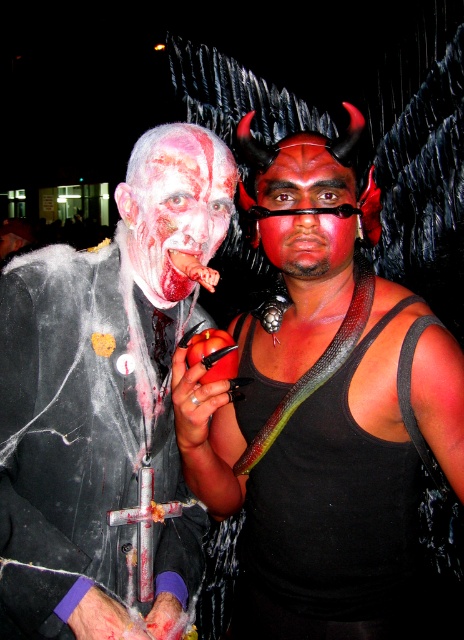
Who is taller, green snake at center or matte red face paint at center?

green snake at center is taller.

Does point (265, 412) come in front of point (323, 268)?

No, (265, 412) is behind (323, 268).

Is point (210, 627) more distant than point (283, 147)?

Yes, point (210, 627) is farther from viewer.

The width and height of the screenshot is (464, 640). Find the location of `green snake at center`. green snake at center is located at coordinates (332, 525).

Between matte black cross at center and green snake at center, which one is positioned higher?

Positioned higher is matte black cross at center.

Does point (158, 604) come in front of point (354, 604)?

No, (158, 604) is behind (354, 604).

This screenshot has height=640, width=464. Find the location of `matte black cross at center`. matte black cross at center is located at coordinates (104, 401).

Does bloody flesh at center appear over green glossy snake at center?

Yes, bloody flesh at center is above green glossy snake at center.

How distant is bloody flesh at center from green glossy snake at center?

bloody flesh at center and green glossy snake at center are 34.24 centimeters apart from each other.

Where is `bloody flesh at center`? bloody flesh at center is located at coordinates (179, 209).